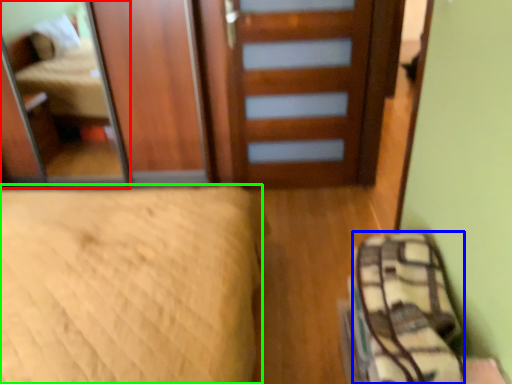
Question: Which is farther away from mirror (highlighted by a red box)? material (highlighted by a blue box) or bed (highlighted by a green box)?

Choices:
 (A) material
 (B) bed

Answer: (A)